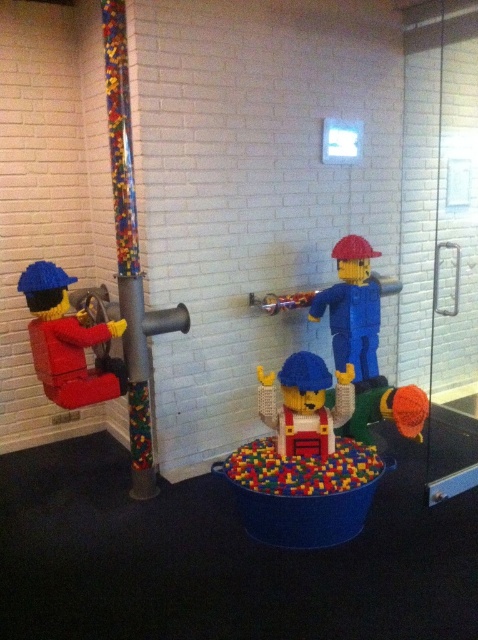
Question: Among these points, which one is farthest from the camera?

Choices:
 (A) (113, 388)
 (B) (312, 440)

Answer: (A)

Question: Is matte red brick figure at left above matte blue construction worker at center?

Choices:
 (A) yes
 (B) no

Answer: (A)

Question: Can you confirm if matte red brick figure at left is positioned above matte blue construction worker at center?

Choices:
 (A) no
 (B) yes

Answer: (B)

Question: Among these points, which one is nearest to the camera?

Choices:
 (A) (313, 355)
 (B) (86, 330)

Answer: (B)

Question: Among these points, which one is farthest from the camera?

Choices:
 (A) (76, 344)
 (B) (343, 422)

Answer: (B)

Question: Is matte red brick figure at left wider than matte blue construction worker at center?

Choices:
 (A) no
 (B) yes

Answer: (B)